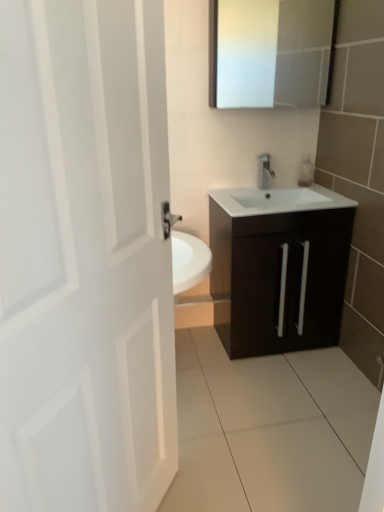
Question: Considering the relative sizes of satin nickel faucet at center and white glossy medicine cabinet at upper center in the image provided, is satin nickel faucet at center taller than white glossy medicine cabinet at upper center?

Choices:
 (A) yes
 (B) no

Answer: (B)

Question: Is white glossy medicine cabinet at upper center inside satin nickel faucet at center?

Choices:
 (A) yes
 (B) no

Answer: (B)

Question: Is satin nickel faucet at center in front of white glossy medicine cabinet at upper center?

Choices:
 (A) yes
 (B) no

Answer: (B)

Question: Does satin nickel faucet at center have a smaller size compared to white glossy medicine cabinet at upper center?

Choices:
 (A) no
 (B) yes

Answer: (B)

Question: Is satin nickel faucet at center behind white glossy medicine cabinet at upper center?

Choices:
 (A) no
 (B) yes

Answer: (B)

Question: Considering the positions of white glossy medicine cabinet at upper center and white matte door at left in the image, is white glossy medicine cabinet at upper center taller or shorter than white matte door at left?

Choices:
 (A) short
 (B) tall

Answer: (A)

Question: Is white glossy medicine cabinet at upper center wider or thinner than white matte door at left?

Choices:
 (A) thin
 (B) wide

Answer: (A)

Question: Would you say white glossy medicine cabinet at upper center is to the left or to the right of white matte door at left in the picture?

Choices:
 (A) right
 (B) left

Answer: (A)

Question: From a real-world perspective, is white glossy medicine cabinet at upper center above or below white matte door at left?

Choices:
 (A) below
 (B) above

Answer: (B)

Question: Is matte dark brown cabinet at center wider or thinner than satin nickel faucet at center?

Choices:
 (A) thin
 (B) wide

Answer: (B)

Question: Is matte dark brown cabinet at center to the left or to the right of satin nickel faucet at center in the image?

Choices:
 (A) left
 (B) right

Answer: (B)

Question: Is matte dark brown cabinet at center situated inside satin nickel faucet at center or outside?

Choices:
 (A) outside
 (B) inside

Answer: (A)

Question: From the image's perspective, is matte dark brown cabinet at center located above or below satin nickel faucet at center?

Choices:
 (A) above
 (B) below

Answer: (B)

Question: Looking at their shapes, would you say white matte door at left is wider or thinner than white glossy medicine cabinet at upper center?

Choices:
 (A) wide
 (B) thin

Answer: (A)

Question: From a real-world perspective, relative to white glossy medicine cabinet at upper center, is white matte door at left vertically above or below?

Choices:
 (A) above
 (B) below

Answer: (B)